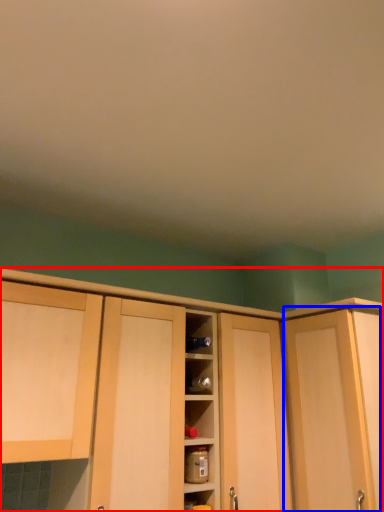
Question: Among these objects, which one is nearest to the camera, cabinetry (highlighted by a red box) or door (highlighted by a blue box)?

Choices:
 (A) cabinetry
 (B) door

Answer: (A)